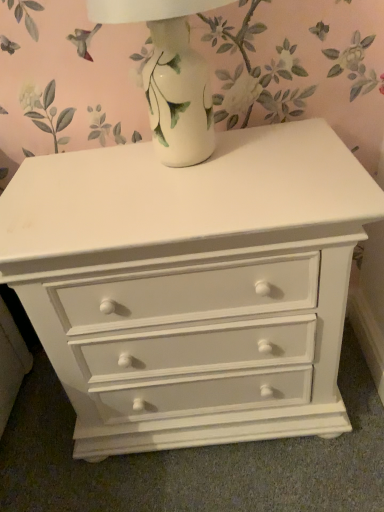
The height and width of the screenshot is (512, 384). Find the location of `free spot in front of white glossy vase at upper center`. free spot in front of white glossy vase at upper center is located at coordinates (199, 206).